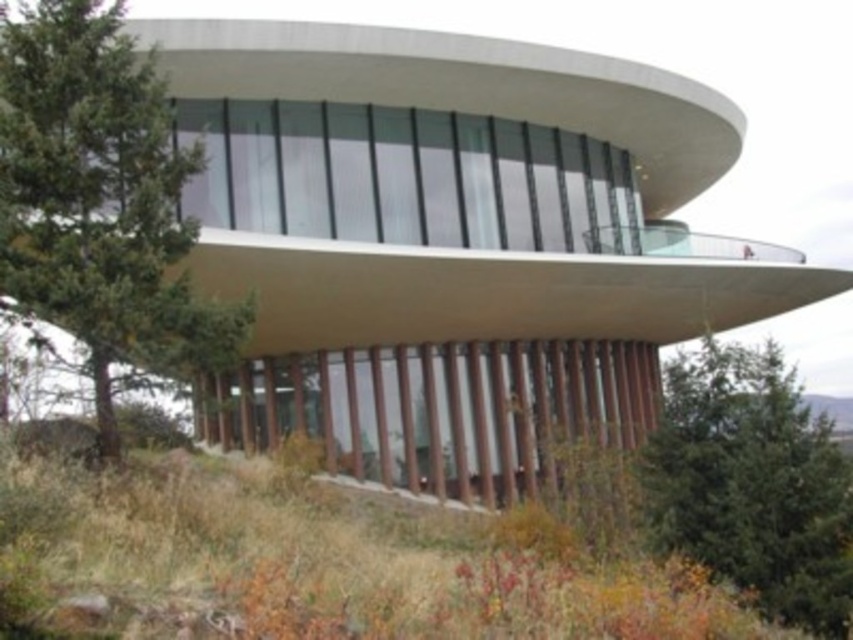
You are standing in front of the modern building and want to take a photo that includes both the green coniferous tree at left and the green leafy tree at lower right. Which tree should you position closer to the left side of the frame to ensure both are visible?

You should position the green coniferous tree at left closer to the left side of the frame because it is already to the left of the green leafy tree at lower right, ensuring both are visible in the photo.

You are an architect analyzing the spatial relationship between two points on the building structure. Given that you are standing at the observation deck looking at the building, which of the two points, point (161, 204) or point (758, 520), is closer to you?

Point (161, 204) is closer to you because it is further to the viewer than point (758, 520).

You are a landscape architect planning to place a new bench in the garden area near the building. You want to ensure the bench is positioned where it can be seen from both the green coniferous tree at left and the green leafy tree at lower right. Given their sizes, which tree might offer a better vantage point for viewing the bench?

The green coniferous tree at left is bigger than the green leafy tree at lower right, so it might offer a better vantage point for viewing the bench due to its larger size providing a wider field of view.